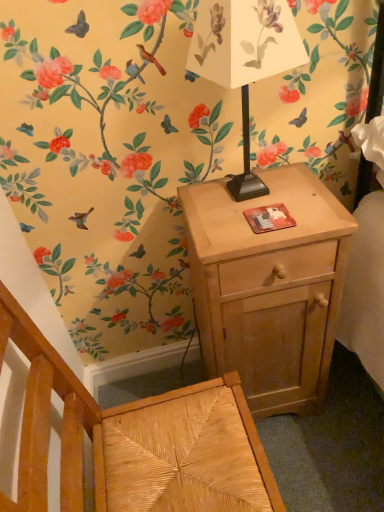
The image size is (384, 512). What are the coordinates of `free spot below white paper lampshade at upper center (from a real-world perspective)` in the screenshot? It's located at (240, 200).